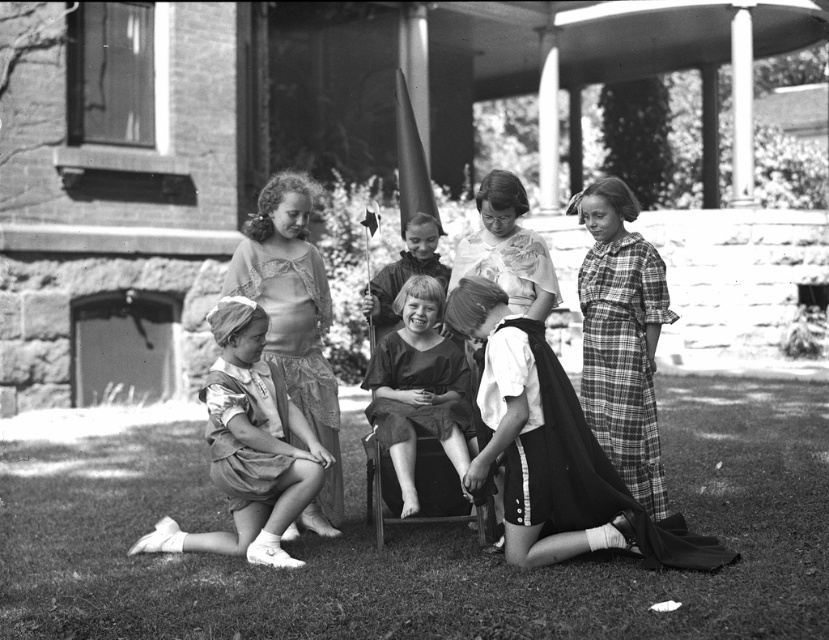
Question: Does matte pink blouse at center appear on the right side of smooth fabric dress at center?

Choices:
 (A) no
 (B) yes

Answer: (A)

Question: Which of the following is the closest to the observer?

Choices:
 (A) (545, 278)
 (B) (297, 308)
 (C) (396, 298)

Answer: (C)

Question: Is matte white dress at lower left behind plaid fabric dress at right?

Choices:
 (A) yes
 (B) no

Answer: (B)

Question: Which point appears farthest from the camera in this image?

Choices:
 (A) (405, 296)
 (B) (275, 438)

Answer: (A)

Question: Considering the relative positions of matte white dress at lower left and plaid fabric dress at right in the image provided, where is matte white dress at lower left located with respect to plaid fabric dress at right?

Choices:
 (A) below
 (B) above

Answer: (A)

Question: Which is nearer to the matte white dress at lower left?

Choices:
 (A) dark fabric dress at center
 (B) grassy lawn at lower center
 (C) matte pink blouse at center
 (D) plaid fabric dress at right

Answer: (C)